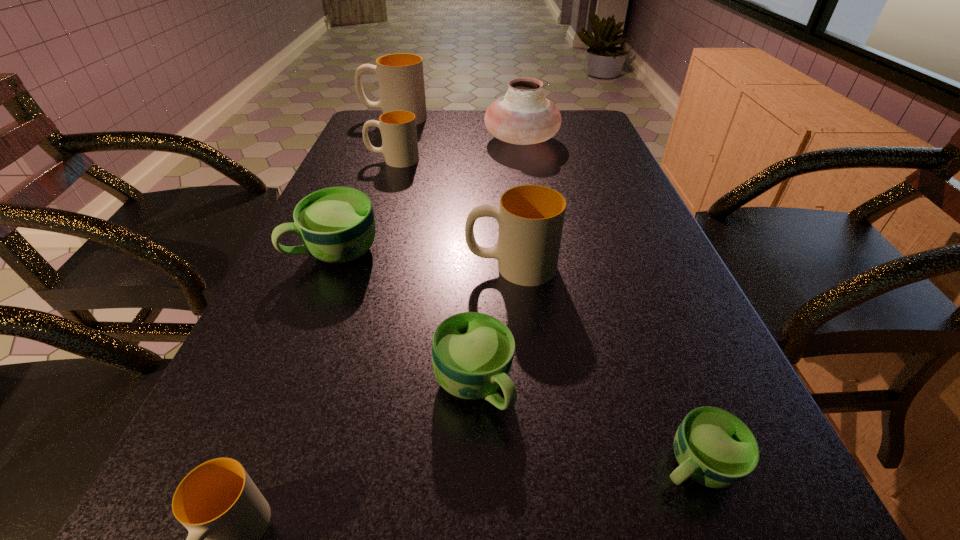
The image size is (960, 540). I want to click on the third nearest cup, so click(472, 353).

At what (x,y) coordinates should I click in order to perform the action: click on the nearest blue cup. Please return your answer as a coordinate pair (x, y). Looking at the image, I should click on (715, 448).

The width and height of the screenshot is (960, 540). I want to click on the shortest object, so click(715, 448).

Where is `vacant area situated 0.140m on the right of the pottery`? vacant area situated 0.140m on the right of the pottery is located at coordinates (605, 141).

Locate an element on the screen. The width and height of the screenshot is (960, 540). free region located 0.280m with the handle on the side of the second nearest yellow cup is located at coordinates (324, 267).

Identify the location of vacant region located with the handle on the side of the second nearest yellow cup. The width and height of the screenshot is (960, 540). (360, 267).

I want to click on vacant area situated with the handle on the side of the second nearest yellow cup, so click(x=310, y=267).

At what (x,y) coordinates should I click in order to perform the action: click on vacant region located 0.190m on the right of the biggest blue cup. Please return your answer as a coordinate pair (x, y). Image resolution: width=960 pixels, height=540 pixels. Looking at the image, I should click on (471, 252).

The image size is (960, 540). I want to click on vacant space positioned 0.170m on the left of the second biggest blue cup, so click(321, 386).

The height and width of the screenshot is (540, 960). I want to click on vacant area situated on the left of the nearest blue cup, so click(430, 464).